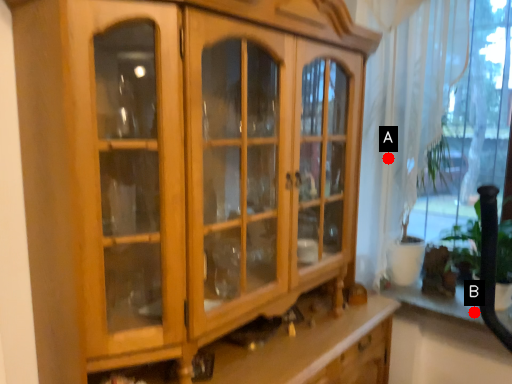
Question: Two points are circled on the image, labeled by A and B beside each circle. Which of the following is the closest to the observer?

Choices:
 (A) A is closer
 (B) B is closer

Answer: (B)